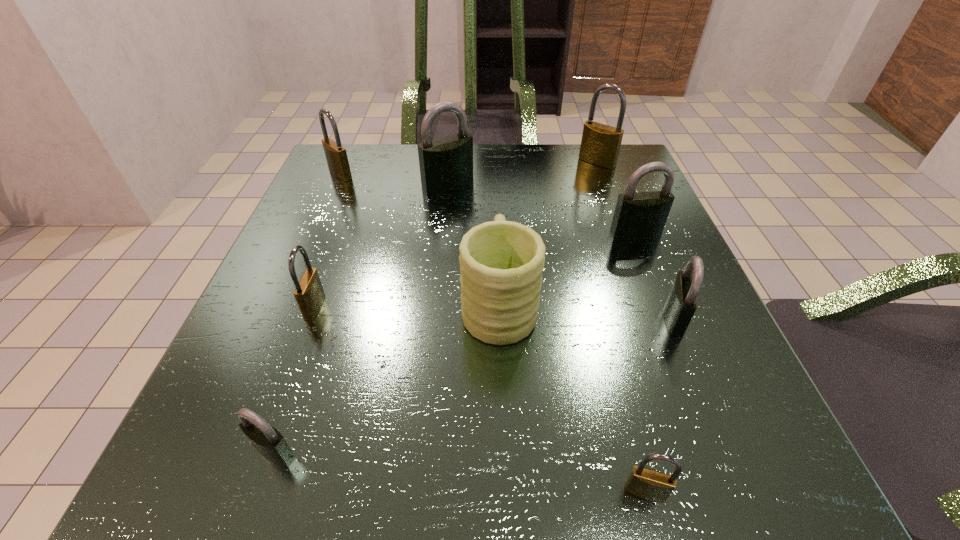
The height and width of the screenshot is (540, 960). In the image, there is a desktop. Find the location of `blank space at the far edge`. blank space at the far edge is located at coordinates (525, 151).

Find the location of `vacant point at the left edge`. vacant point at the left edge is located at coordinates (309, 402).

The image size is (960, 540). In the image, there is a desktop. Find the location of `vacant space at the right edge`. vacant space at the right edge is located at coordinates (705, 426).

I want to click on vacant point at the far left corner, so click(324, 164).

The width and height of the screenshot is (960, 540). Find the location of `free space at the near left corner of the desktop`. free space at the near left corner of the desktop is located at coordinates (199, 481).

Find the location of a particular element. free space at the far right corner is located at coordinates (565, 147).

The width and height of the screenshot is (960, 540). What are the coordinates of `free spot between the smallest brass padlock and the sixth nearest object` in the screenshot? It's located at (640, 362).

Identify the location of empty space between the second smallest black padlock and the nearest black padlock. The image size is (960, 540). (474, 385).

Where is `vacant area between the second nearest object and the biggest brass padlock`? The image size is (960, 540). vacant area between the second nearest object and the biggest brass padlock is located at coordinates (436, 307).

This screenshot has height=540, width=960. What are the coordinates of `vacant area that lies between the biggest brass padlock and the farthest black padlock` in the screenshot? It's located at (522, 172).